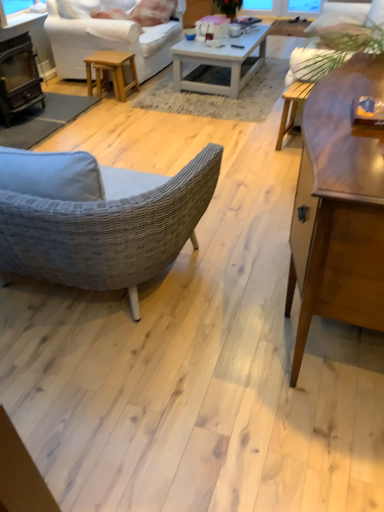
Question: Is there a large distance between white cotton pillow at upper center and wooden coffee table at center, the 2th coffee table in the top-to-bottom sequence?

Choices:
 (A) no
 (B) yes

Answer: (B)

Question: Does white cotton pillow at upper center have a greater height compared to wooden coffee table at center, the 2th coffee table in the top-to-bottom sequence?

Choices:
 (A) no
 (B) yes

Answer: (A)

Question: Does white cotton pillow at upper center lie behind wooden coffee table at center, which appears as the 1th coffee table when ordered from the bottom?

Choices:
 (A) no
 (B) yes

Answer: (B)

Question: Would you say white cotton pillow at upper center is outside wooden coffee table at center, the 2th coffee table in the top-to-bottom sequence?

Choices:
 (A) yes
 (B) no

Answer: (A)

Question: Does white cotton pillow at upper center have a greater width compared to wooden coffee table at center, which appears as the 2th coffee table when viewed from the back?

Choices:
 (A) no
 (B) yes

Answer: (A)

Question: In terms of size, does wooden coffee table at center, the 2th coffee table in the top-to-bottom sequence, appear bigger or smaller than white fabric studio couch at upper left?

Choices:
 (A) small
 (B) big

Answer: (A)

Question: Is wooden coffee table at center, the 2th coffee table in the top-to-bottom sequence, situated inside white fabric studio couch at upper left or outside?

Choices:
 (A) inside
 (B) outside

Answer: (B)

Question: Based on their positions, is wooden coffee table at center, the first coffee table positioned from the front, located to the left or right of white fabric studio couch at upper left?

Choices:
 (A) right
 (B) left

Answer: (A)

Question: Relative to white fabric studio couch at upper left, is wooden coffee table at center, which appears as the 2th coffee table when viewed from the back, in front or behind?

Choices:
 (A) front
 (B) behind

Answer: (A)

Question: Is point (208, 91) positioned closer to the camera than point (62, 42)?

Choices:
 (A) closer
 (B) farther

Answer: (A)

Question: In terms of size, does white glossy coffee table at center, the second coffee table when ordered from front to back, appear bigger or smaller than white fabric studio couch at upper left?

Choices:
 (A) big
 (B) small

Answer: (B)

Question: Considering the positions of white glossy coffee table at center, the second coffee table when ordered from front to back, and white fabric studio couch at upper left in the image, is white glossy coffee table at center, the second coffee table when ordered from front to back, taller or shorter than white fabric studio couch at upper left?

Choices:
 (A) tall
 (B) short

Answer: (B)

Question: From a real-world perspective, relative to white fabric studio couch at upper left, is white glossy coffee table at center, which is counted as the first coffee table, starting from the top, vertically above or below?

Choices:
 (A) above
 (B) below

Answer: (B)

Question: Is wooden coffee table at center, which appears as the 2th coffee table when viewed from the back, wider or thinner than white cotton pillow at upper center?

Choices:
 (A) thin
 (B) wide

Answer: (B)

Question: Based on their sizes in the image, would you say wooden coffee table at center, which appears as the 2th coffee table when viewed from the back, is bigger or smaller than white cotton pillow at upper center?

Choices:
 (A) big
 (B) small

Answer: (A)